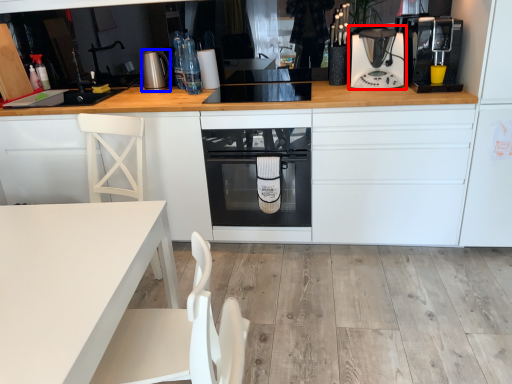
Question: Which of the following is the closest to the observer, kitchen appliance (highlighted by a red box) or kitchen appliance (highlighted by a blue box)?

Choices:
 (A) kitchen appliance
 (B) kitchen appliance

Answer: (A)